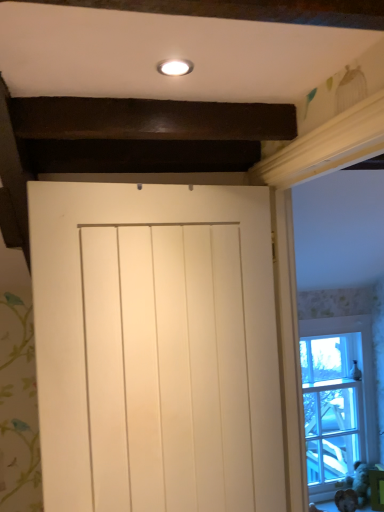
Question: Is brown furry animal at lower right bigger or smaller than white matte door at center?

Choices:
 (A) big
 (B) small

Answer: (B)

Question: Considering the positions of brown furry animal at lower right and white matte door at center in the image, is brown furry animal at lower right wider or thinner than white matte door at center?

Choices:
 (A) thin
 (B) wide

Answer: (A)

Question: Based on their relative distances, which object is nearer to the white matte door at center?

Choices:
 (A) brown furry animal at lower right
 (B) clear glass window at right
 (C) white painted wood at upper right

Answer: (C)

Question: Which object is the farthest from the white matte door at center?

Choices:
 (A) white painted wood at upper right
 (B) brown furry animal at lower right
 (C) clear glass window at right

Answer: (B)